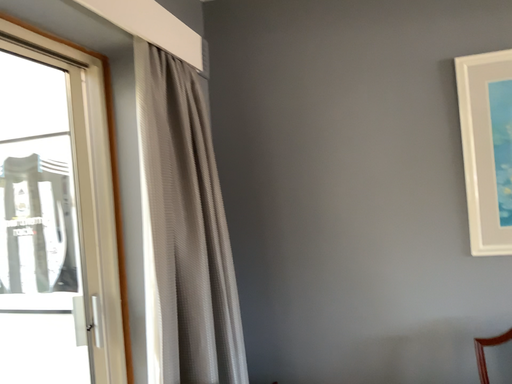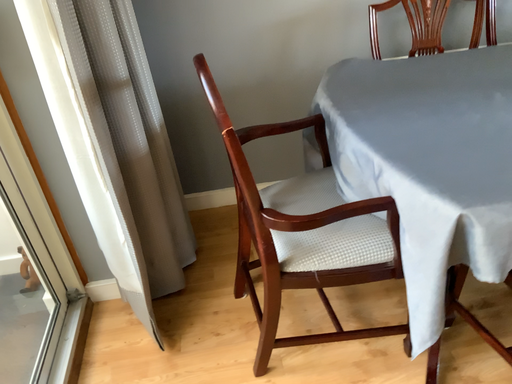
Question: Which way did the camera rotate in the video?

Choices:
 (A) rotated right
 (B) rotated left

Answer: (A)